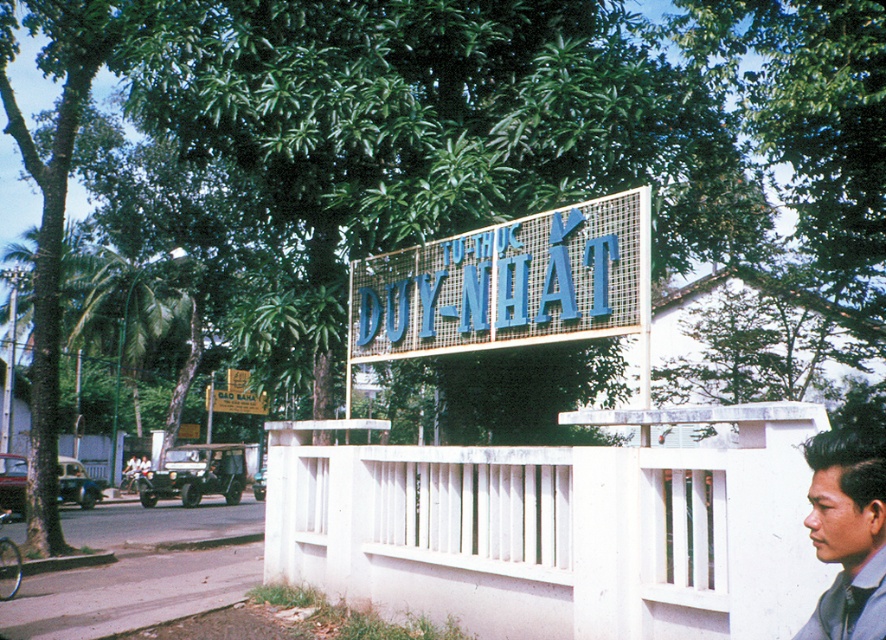
Question: Can you confirm if blue metallic sign at center is wider than matte blue shirt at lower right?

Choices:
 (A) yes
 (B) no

Answer: (A)

Question: Which of the following is the farthest from the observer?

Choices:
 (A) (539, 310)
 (B) (841, 440)

Answer: (A)

Question: Is blue metallic sign at center behind matte blue shirt at lower right?

Choices:
 (A) yes
 (B) no

Answer: (A)

Question: Which point appears closest to the camera in this image?

Choices:
 (A) (479, 284)
 (B) (881, 564)

Answer: (B)

Question: Is blue metallic sign at center closer to camera compared to matte blue shirt at lower right?

Choices:
 (A) no
 (B) yes

Answer: (A)